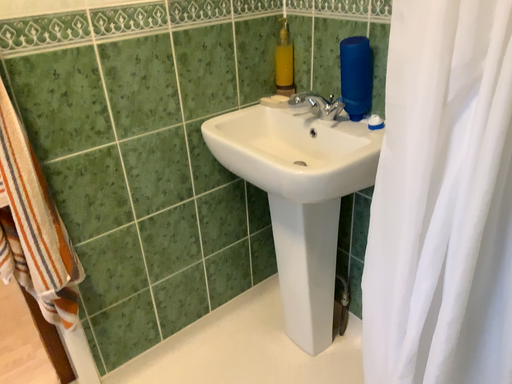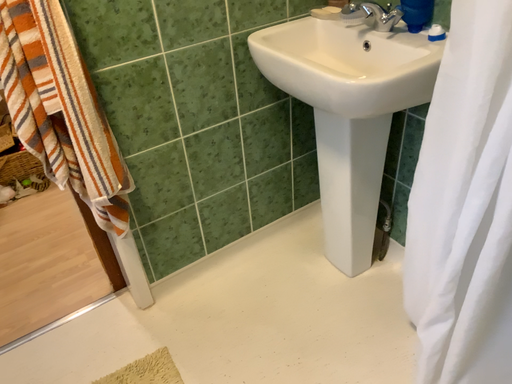
Question: Which way did the camera rotate in the video?

Choices:
 (A) rotated upward
 (B) rotated downward

Answer: (B)